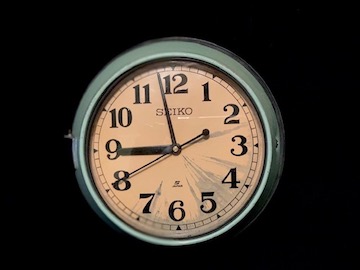
Where is `clock`? clock is located at coordinates (175, 168).